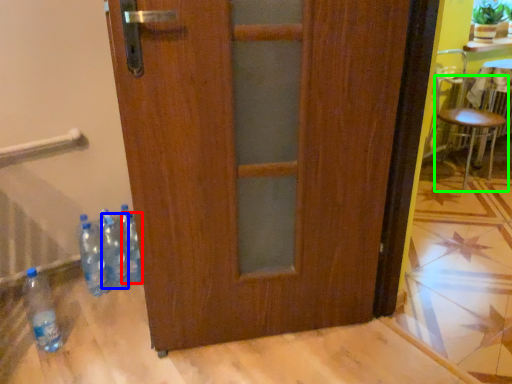
Question: Based on their relative distances, which object is nearer to bottle (highlighted by a red box)? Choose from bottle (highlighted by a blue box) and chair (highlighted by a green box).

Choices:
 (A) bottle
 (B) chair

Answer: (A)